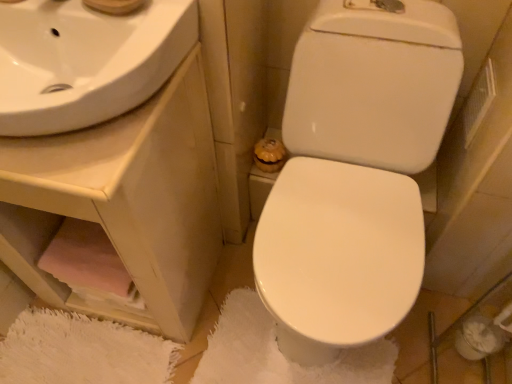
Question: From a real-world perspective, is white glossy sink at upper left on white fluffy bath mat at center?

Choices:
 (A) no
 (B) yes

Answer: (B)

Question: Is white glossy sink at upper left at the right side of white fluffy bath mat at center?

Choices:
 (A) no
 (B) yes

Answer: (A)

Question: Is white glossy sink at upper left surrounding white fluffy bath mat at center?

Choices:
 (A) yes
 (B) no

Answer: (B)

Question: Can you confirm if white glossy sink at upper left is wider than white fluffy bath mat at center?

Choices:
 (A) yes
 (B) no

Answer: (B)

Question: Is white glossy sink at upper left facing away from white fluffy bath mat at center?

Choices:
 (A) yes
 (B) no

Answer: (B)

Question: Considering the relative sizes of white glossy sink at upper left and white fluffy bath mat at center in the image provided, is white glossy sink at upper left bigger than white fluffy bath mat at center?

Choices:
 (A) yes
 (B) no

Answer: (A)

Question: Is white glossy toilet at center at the back of white glossy sink at upper left?

Choices:
 (A) no
 (B) yes

Answer: (A)

Question: Considering the relative sizes of white glossy sink at upper left and white glossy toilet at center in the image provided, is white glossy sink at upper left wider than white glossy toilet at center?

Choices:
 (A) no
 (B) yes

Answer: (A)

Question: Is white glossy sink at upper left smaller than white glossy toilet at center?

Choices:
 (A) no
 (B) yes

Answer: (B)

Question: From the image's perspective, is white glossy sink at upper left above white glossy toilet at center?

Choices:
 (A) yes
 (B) no

Answer: (A)

Question: Considering the relative sizes of white glossy sink at upper left and white glossy toilet at center in the image provided, is white glossy sink at upper left bigger than white glossy toilet at center?

Choices:
 (A) no
 (B) yes

Answer: (A)

Question: Is white glossy sink at upper left at the left side of white glossy toilet at center?

Choices:
 (A) no
 (B) yes

Answer: (B)

Question: From the image's perspective, is pink fabric at lower left beneath white glossy sink at upper left?

Choices:
 (A) no
 (B) yes

Answer: (B)